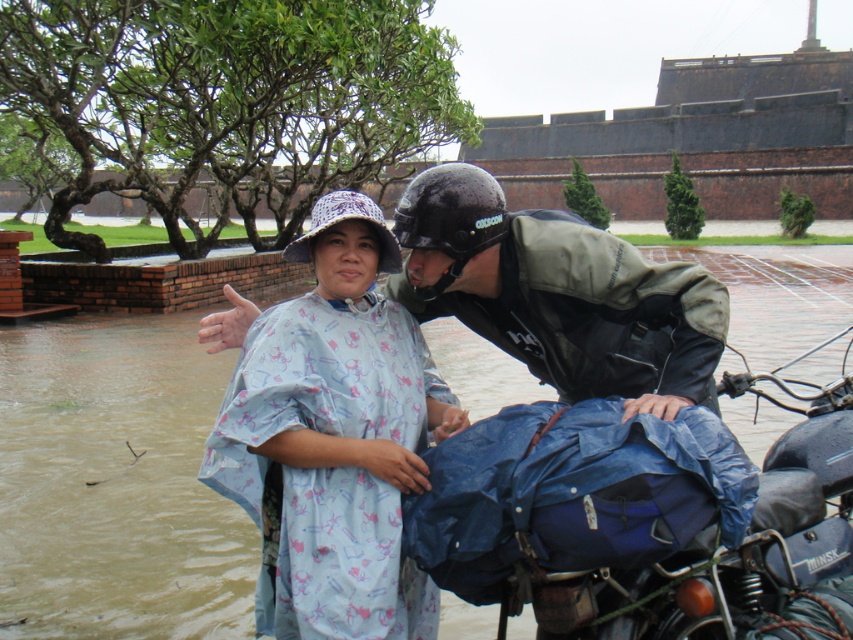
Does light blue cotton dress at center have a smaller size compared to blue fabric-covered motorcycle at center?

Yes.

Does light blue cotton dress at center have a greater height compared to blue fabric-covered motorcycle at center?

No.

Who is more forward, (x=606, y=365) or (x=442, y=349)?

Point (x=606, y=365) is more forward.

The width and height of the screenshot is (853, 640). I want to click on light blue cotton dress at center, so click(x=560, y=294).

Is blue printed raincoat at center wider than light blue cotton dress at center?

In fact, blue printed raincoat at center might be narrower than light blue cotton dress at center.

Between point (426, 605) and point (637, 284), which one is positioned behind?

Point (426, 605)

Who is more forward, (254,378) or (462,176)?

Point (254,378)

Identify the location of blue printed raincoat at center. (331, 435).

Between blue printed raincoat at center and blue fabric-covered motorcycle at center, which one has less height?

Standing shorter between the two is blue printed raincoat at center.

Which is above, blue printed raincoat at center or blue fabric-covered motorcycle at center?

blue fabric-covered motorcycle at center

Is point (376, 435) positioned in front of point (508, 634)?

Yes, point (376, 435) is closer to viewer.

Where is `blue printed raincoat at center`? blue printed raincoat at center is located at coordinates (331, 435).